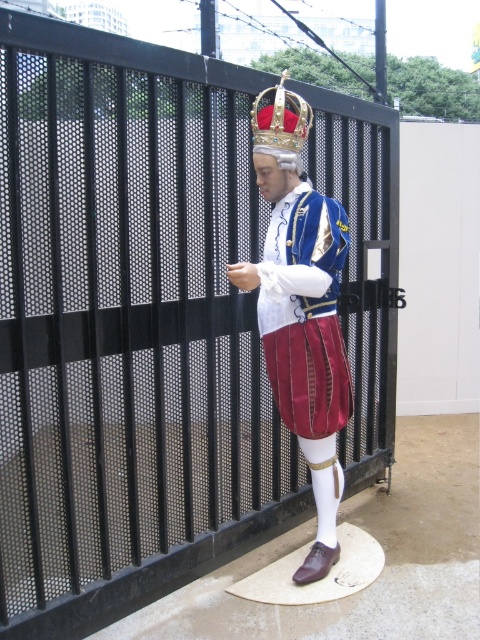
You are a costume designer examining the image of a historical character. You need to determine the spatial relationship between the velvet maroon pants at center and the goldmetalliccrown at upper center. Which object is positioned higher in the image?

The goldmetalliccrown at upper center is positioned higher than the velvet maroon pants at center.

You are standing at the camera position and want to throw a small ball to hit the point marked as point (314, 291). Considering the distance, is it possible to reach that point with an average throw?

The distance between you and point (314, 291) is 2.68 meters. An average throw can typically reach around 15 to 20 meters, so yes, it is possible to reach the point with an average throw.